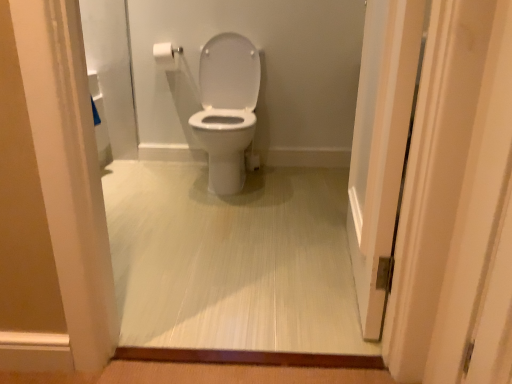
Question: From a real-world perspective, relative to white glossy toilet at center, is white glossy door at right vertically above or below?

Choices:
 (A) above
 (B) below

Answer: (A)

Question: From the image's perspective, is white glossy door at right positioned above or below white glossy toilet at center?

Choices:
 (A) above
 (B) below

Answer: (B)

Question: Which of these objects is positioned farthest from the white matte toilet paper at upper left?

Choices:
 (A) white glossy toilet at center
 (B) white glossy door at right
 (C) white glossy toilet at center

Answer: (B)

Question: Considering the real-world distances, which object is farthest from the white matte toilet paper at upper left?

Choices:
 (A) white glossy toilet at center
 (B) white glossy door at right
 (C) white glossy toilet at center

Answer: (B)